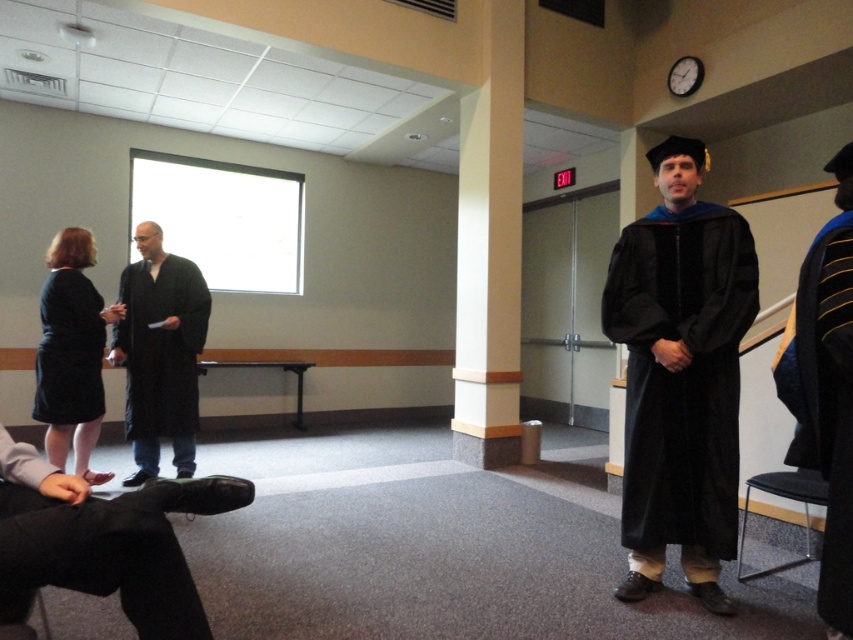
Question: Which object is closer to the camera taking this photo?

Choices:
 (A) black fabric dress at left
 (B) black matte dress at left
 (C) black matte graduation gown at right

Answer: (C)

Question: Does black velvet gown at center have a greater width compared to black matte dress at left?

Choices:
 (A) no
 (B) yes

Answer: (B)

Question: Is black matte graduation gown at right positioned before black matte dress at left?

Choices:
 (A) yes
 (B) no

Answer: (A)

Question: Estimate the real-world distances between objects in this image. Which object is farther from the black velvet gown at center?

Choices:
 (A) black matte robe at left
 (B) black matte dress at left

Answer: (B)

Question: Which object appears farthest from the camera in this image?

Choices:
 (A) black velvet gown at center
 (B) black matte robe at left
 (C) black matte dress at left

Answer: (B)

Question: Considering the relative positions of black matte robe at left and black matte dress at left in the image provided, where is black matte robe at left located with respect to black matte dress at left?

Choices:
 (A) above
 (B) below

Answer: (B)